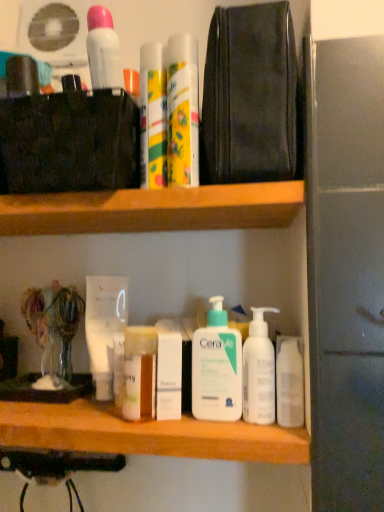
Find the location of `free space to the left of white matte tube at center, which is the 1th mouthwash in bottom-to-top order`. free space to the left of white matte tube at center, which is the 1th mouthwash in bottom-to-top order is located at coordinates (44, 401).